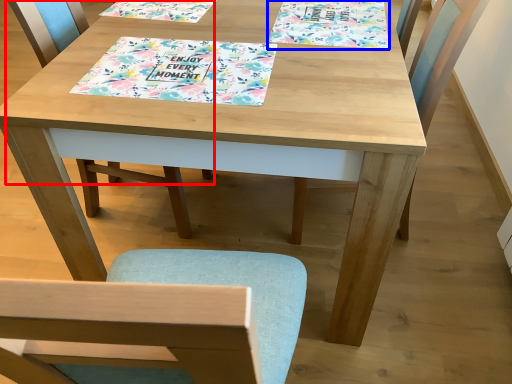
Question: Which point is further to the camera, chair (highlighted by a red box) or book cover (highlighted by a blue box)?

Choices:
 (A) chair
 (B) book cover

Answer: (B)